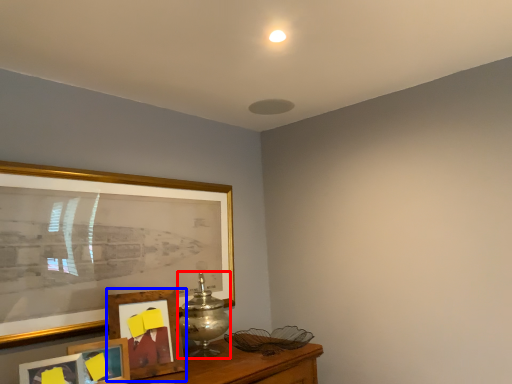
Question: Which of the following is the closest to the observer, table lamp (highlighted by a red box) or picture frame (highlighted by a blue box)?

Choices:
 (A) table lamp
 (B) picture frame

Answer: (B)